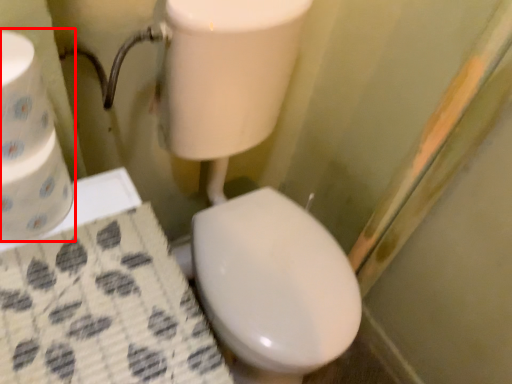
Question: From the image's perspective, considering the relative positions of toilet paper (annotated by the red box) and toilet paper in the image provided, where is toilet paper (annotated by the red box) located with respect to the staircase?

Choices:
 (A) above
 (B) below

Answer: (B)